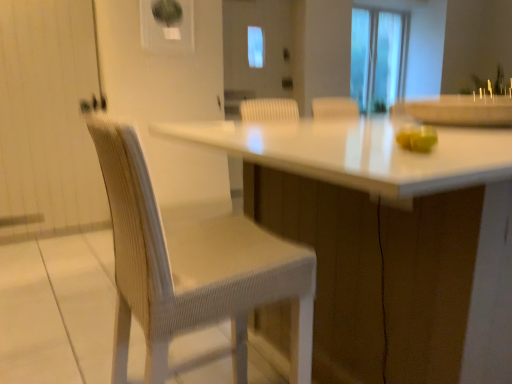
Question: Can you confirm if transparent glass screen door at center is bigger than green matte apple at right?

Choices:
 (A) no
 (B) yes

Answer: (B)

Question: Considering the relative positions of transparent glass screen door at center and green matte apple at right in the image provided, is transparent glass screen door at center to the left of green matte apple at right from the viewer's perspective?

Choices:
 (A) no
 (B) yes

Answer: (B)

Question: Considering the relative sizes of transparent glass screen door at center and green matte apple at right in the image provided, is transparent glass screen door at center shorter than green matte apple at right?

Choices:
 (A) no
 (B) yes

Answer: (A)

Question: Can we say transparent glass screen door at center lies outside green matte apple at right?

Choices:
 (A) no
 (B) yes

Answer: (B)

Question: Is transparent glass screen door at center oriented towards green matte apple at right?

Choices:
 (A) no
 (B) yes

Answer: (A)

Question: Is transparent glass screen door at center oriented away from green matte apple at right?

Choices:
 (A) yes
 (B) no

Answer: (B)

Question: Is green matte apple at right closer to the viewer compared to transparent glass screen door at center?

Choices:
 (A) yes
 (B) no

Answer: (A)

Question: Is green matte apple at right in contact with transparent glass screen door at center?

Choices:
 (A) no
 (B) yes

Answer: (A)

Question: From the image's perspective, would you say green matte apple at right is positioned over transparent glass screen door at center?

Choices:
 (A) no
 (B) yes

Answer: (A)

Question: Is green matte apple at right bigger than transparent glass screen door at center?

Choices:
 (A) no
 (B) yes

Answer: (A)

Question: From a real-world perspective, is green matte apple at right located beneath transparent glass screen door at center?

Choices:
 (A) no
 (B) yes

Answer: (B)

Question: From the image's perspective, is green matte apple at right located beneath transparent glass screen door at center?

Choices:
 (A) no
 (B) yes

Answer: (B)

Question: Is green matte apple at right smaller than white glossy table at center?

Choices:
 (A) yes
 (B) no

Answer: (A)